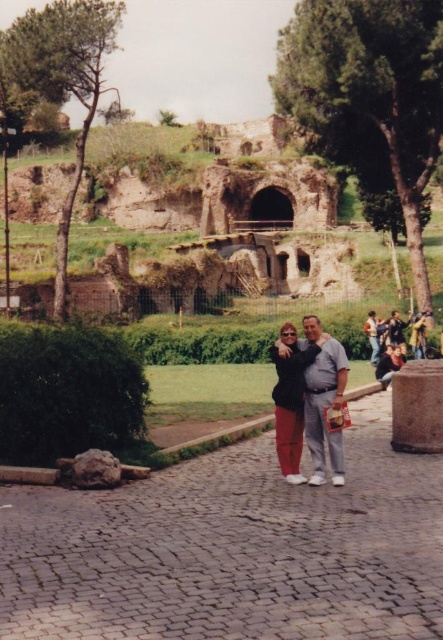
Question: Which point is farther to the camera?

Choices:
 (A) leather jacket at center
 (B) matte black jacket at center

Answer: (A)

Question: Which object appears farthest from the camera in this image?

Choices:
 (A) matte black jacket at center
 (B) leather jacket at center

Answer: (B)

Question: Can you confirm if matte black jacket at center is positioned to the left of smooth gray shirt at right?

Choices:
 (A) no
 (B) yes

Answer: (B)

Question: Which object is the closest to the smooth gray shirt at right?

Choices:
 (A) matte black jacket at center
 (B) leather jacket at center

Answer: (B)

Question: Can you confirm if matte black jacket at center is positioned above leather jacket at center?

Choices:
 (A) no
 (B) yes

Answer: (A)

Question: Can you confirm if matte black jacket at center is positioned to the right of smooth gray shirt at right?

Choices:
 (A) yes
 (B) no

Answer: (B)